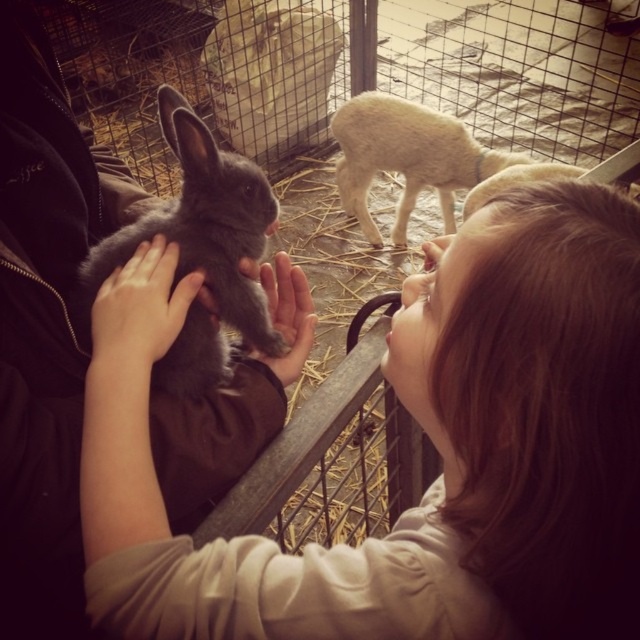
Between smooth gray rabbit at center and fluffy white lamb at upper center, which one has more height?

fluffy white lamb at upper center

Can you confirm if smooth gray rabbit at center is positioned to the left of fluffy white lamb at upper center?

Indeed, smooth gray rabbit at center is positioned on the left side of fluffy white lamb at upper center.

Locate an element on the screen. smooth gray rabbit at center is located at coordinates (433, 442).

From the picture: Between fluffy white lamb at upper center and matte gray rabbit at center, which one appears on the left side from the viewer's perspective?

matte gray rabbit at center is more to the left.

Is fluffy white lamb at upper center shorter than matte gray rabbit at center?

No.

I want to click on fluffy white lamb at upper center, so click(406, 157).

Can you confirm if gray soft fur rabbit at center is taller than smooth skin hand at center?

Yes, gray soft fur rabbit at center is taller than smooth skin hand at center.

Can you confirm if gray soft fur rabbit at center is bigger than smooth skin hand at center?

Yes.

Who is more forward, (216,248) or (136,301)?

Point (136,301)

At what (x,y) coordinates should I click in order to perform the action: click on gray soft fur rabbit at center. Please return your answer as a coordinate pair (x, y). The width and height of the screenshot is (640, 640). Looking at the image, I should click on (200, 227).